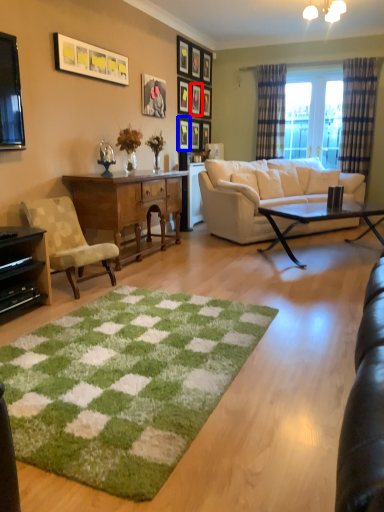
Question: Which of the following is the closest to the observer, picture frame (highlighted by a red box) or picture frame (highlighted by a blue box)?

Choices:
 (A) picture frame
 (B) picture frame

Answer: (B)